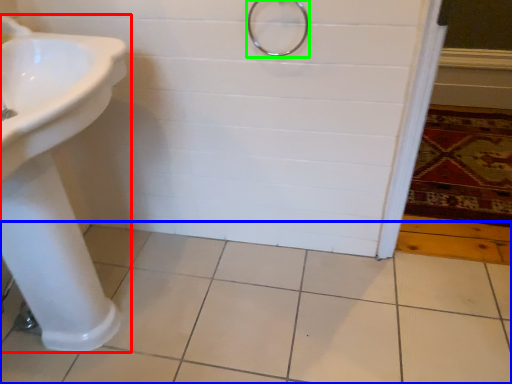
Question: Considering the real-world distances, which object is closest to sink (highlighted by a red box)? ceramic tile (highlighted by a blue box) or shower (highlighted by a green box).

Choices:
 (A) ceramic tile
 (B) shower

Answer: (A)